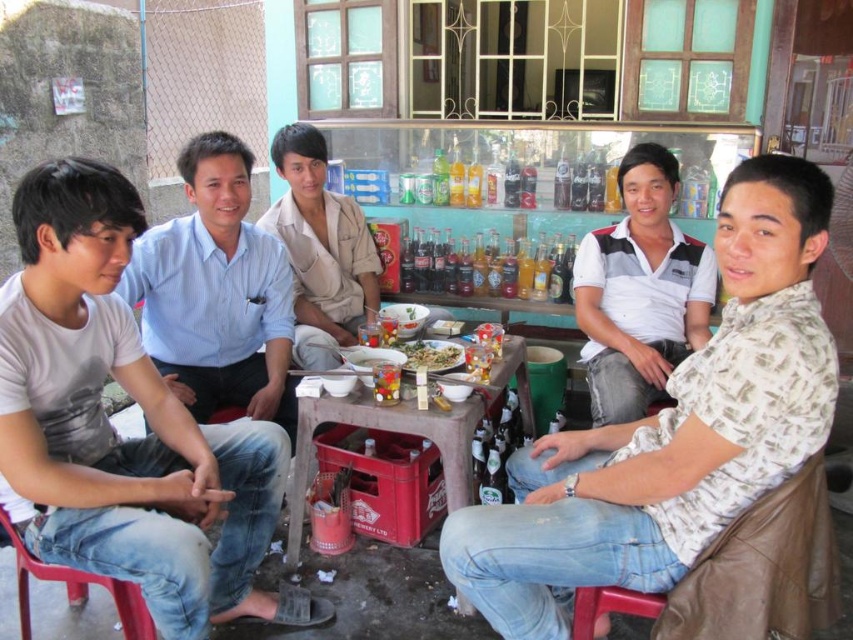
You are a server at the outdoor dining area. You need to place a 60 cm long tray between the light blue shirt at center and the wooden table at center. Is there enough space to fit the tray without moving either object?

The distance between the light blue shirt at center and the wooden table at center is 54.53 centimeters. Since the tray is 60 cm long, it would not fit in the available space.

You are a photographer trying to capture a group photo of the five young men at the table. Since the light blue shirt at center and wooden table at center are both in the frame, which one will appear larger in the photo?

The wooden table at center will appear larger in the photo because it is bigger than the light blue shirt at center.

You are a waiter at this outdoor table and need to place a new dish on the table. The dish requires space to the left of the green matte bowl at center. Is there enough space there, considering the translucent glass bottles at center are currently occupying that area?

The translucent glass bottles at center are to the right of the green matte bowl at center, so placing the dish to the left of the green matte bowl at center would be possible as the bottles are not in that area.